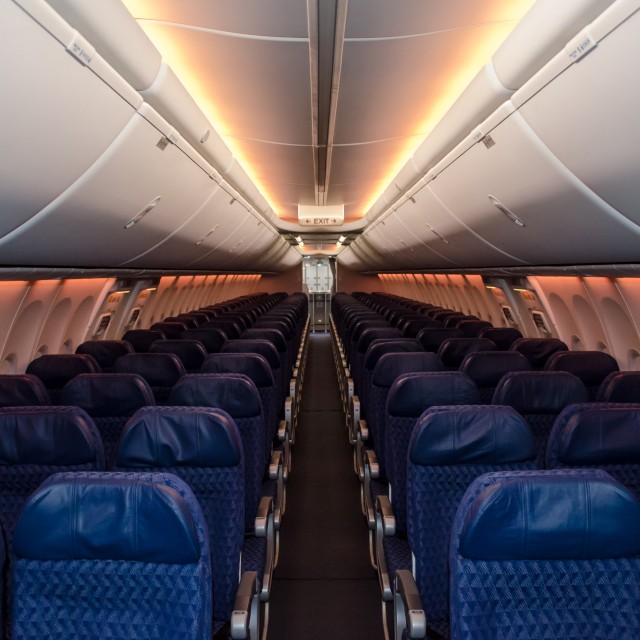
This screenshot has height=640, width=640. Find the location of `exit doors`. exit doors is located at coordinates (106, 324), (134, 315), (511, 310), (532, 320).